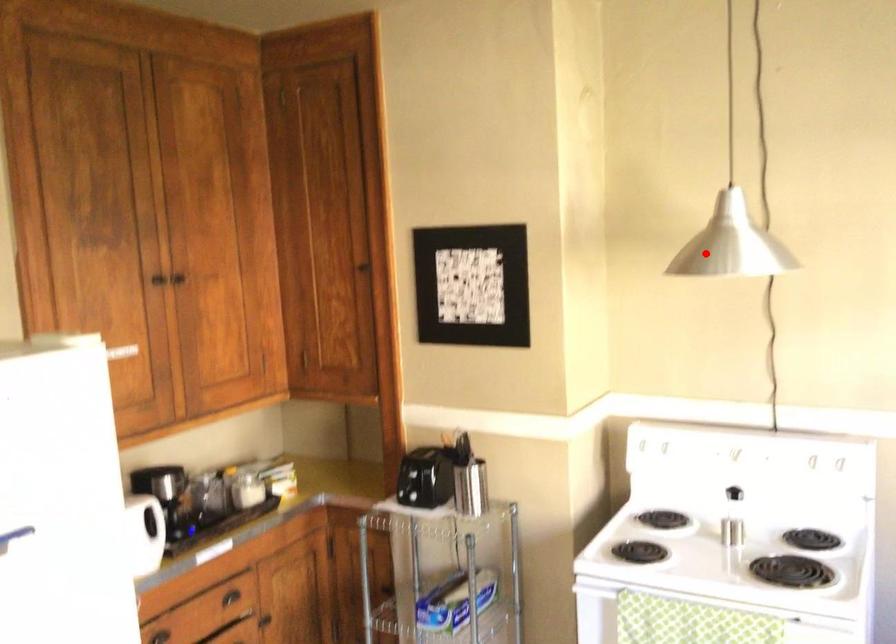
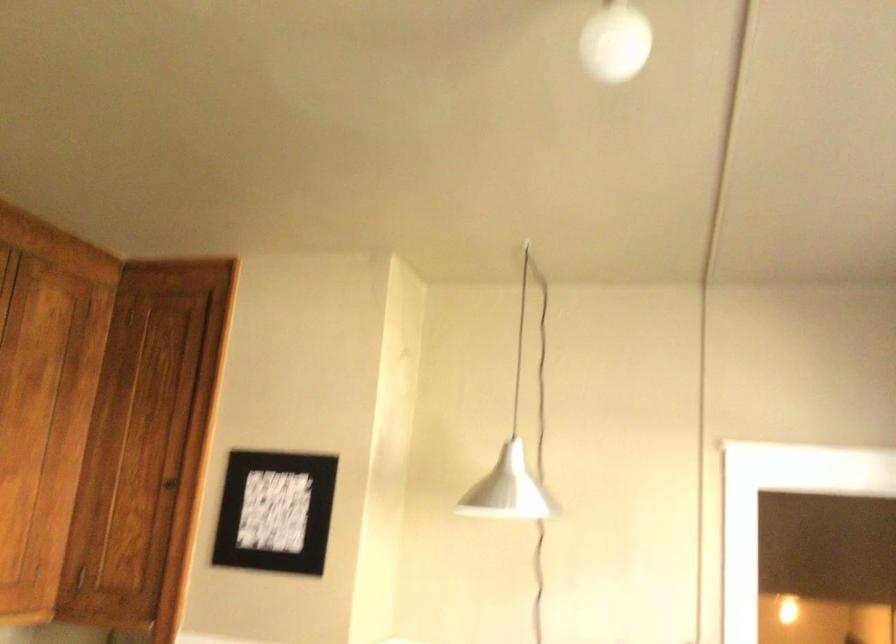
Where in the second image is the point corresponding to the highlighted location from the first image?

(507, 489)